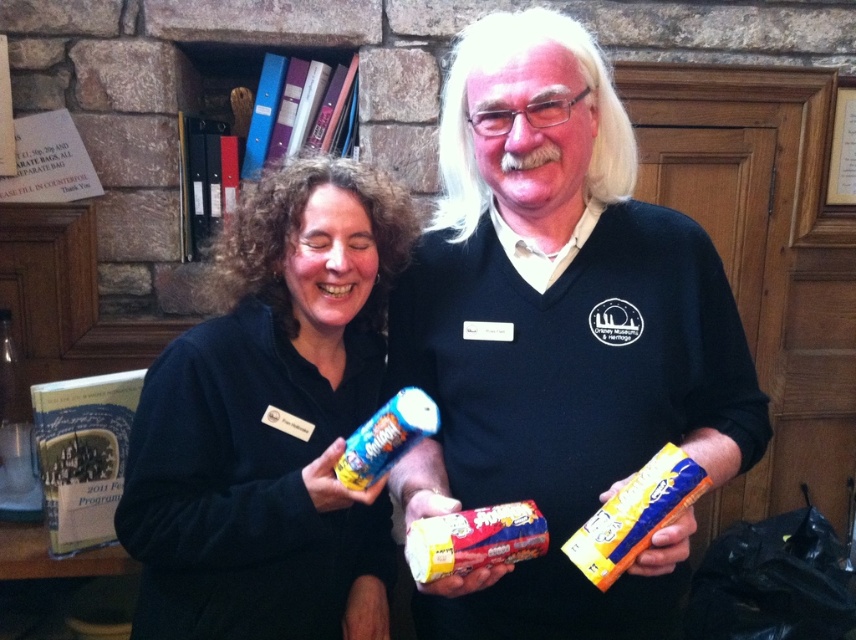
Who is more forward, (134, 499) or (545, 540)?

Point (545, 540) is more forward.

Which is below, black matte can at center or matte plastic snack at center?

Positioned lower is matte plastic snack at center.

Image resolution: width=856 pixels, height=640 pixels. What are the coordinates of `black matte can at center` in the screenshot? It's located at (271, 420).

Consider the image. Which of these two, matte black sweater at center or yellow paper snack at center, stands shorter?

With less height is yellow paper snack at center.

Between matte black sweater at center and yellow paper snack at center, which one has more height?

matte black sweater at center is taller.

Describe the element at coordinates (557, 337) in the screenshot. This screenshot has width=856, height=640. I see `matte black sweater at center` at that location.

Locate an element on the screen. matte black sweater at center is located at coordinates point(557,337).

Does point (259, 250) come closer to viewer compared to point (399, 408)?

No, (259, 250) is behind (399, 408).

Between point (283, 419) and point (351, 465), which one is positioned behind?

Positioned behind is point (283, 419).

Is point (391, 189) positioned before point (372, 436)?

No, (391, 189) is behind (372, 436).

Locate an element on the screen. The image size is (856, 640). black matte can at center is located at coordinates (271, 420).